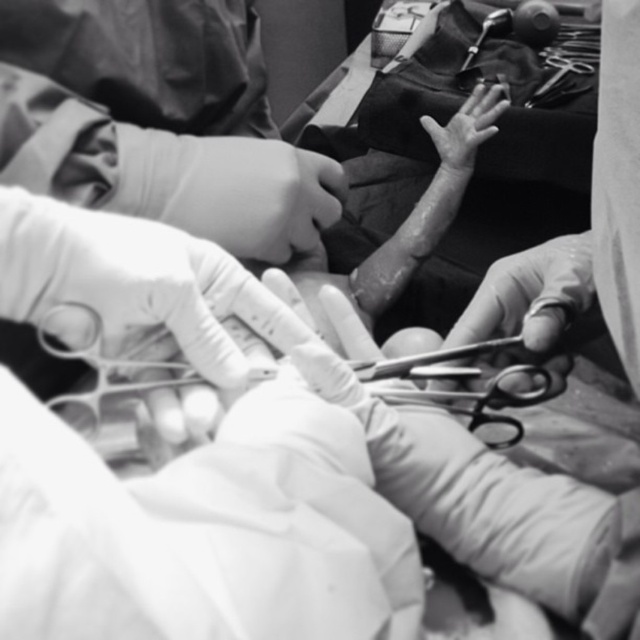
Question: Can you confirm if smooth metal scissors at center is thinner than smooth skin hand at center?

Choices:
 (A) yes
 (B) no

Answer: (A)

Question: Estimate the real-world distances between objects in this image. Which object is farther from the smooth rubber glove at center?

Choices:
 (A) smooth metal scissors at center
 (B) smooth skin hand at center

Answer: (B)

Question: Which of the following is the farthest from the observer?

Choices:
 (A) smooth rubber glove at center
 (B) smooth metal scissors at center

Answer: (A)

Question: Estimate the real-world distances between objects in this image. Which object is farther from the smooth metal scissors at center?

Choices:
 (A) smooth skin hand at center
 (B) smooth rubber glove at center

Answer: (A)

Question: Does smooth rubber glove at center have a greater width compared to smooth metal scissors at center?

Choices:
 (A) yes
 (B) no

Answer: (A)

Question: Does smooth rubber glove at center appear under smooth metal scissors at center?

Choices:
 (A) yes
 (B) no

Answer: (B)